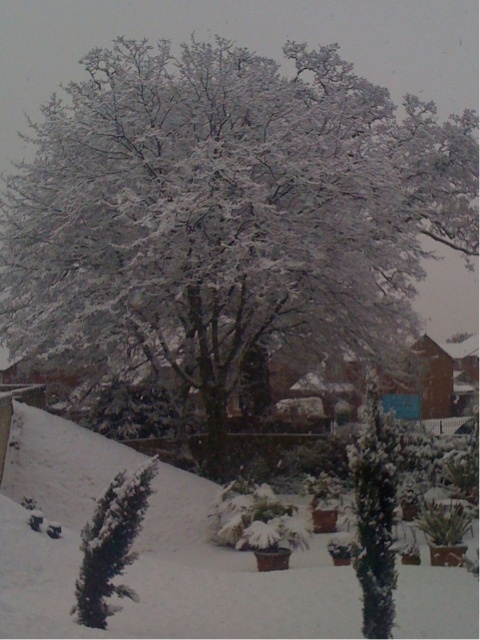
You are a gardener planning to plant a new flower bed between the white fluffy snow at center and the green matte evergreen tree at center. Based on their widths, which one should you place closer to the center of the garden to ensure the flower bed fits properly?

Since the white fluffy snow at center is wider than the green matte evergreen tree at center, you should place the narrower green matte evergreen tree at center closer to the center of the garden to accommodate the flower bed between them.